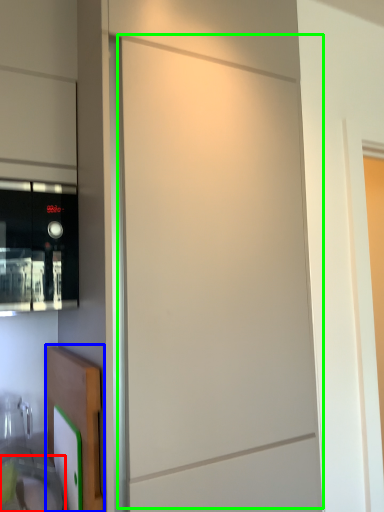
Question: Considering the real-world distances, which object is farthest from sink (highlighted by a red box)? cabinetry (highlighted by a blue box) or screen door (highlighted by a green box)?

Choices:
 (A) cabinetry
 (B) screen door

Answer: (B)